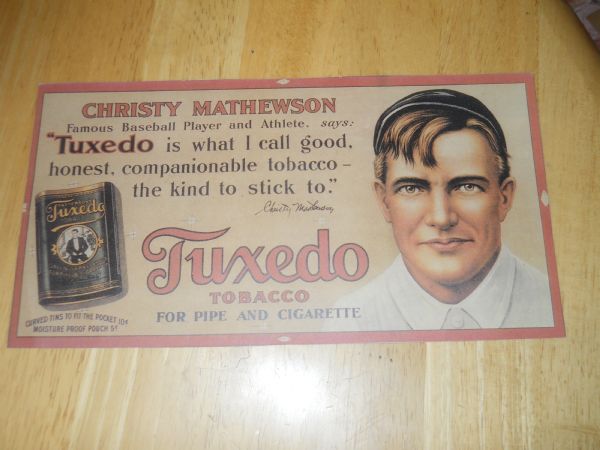
Identify the location of table. (347, 37).